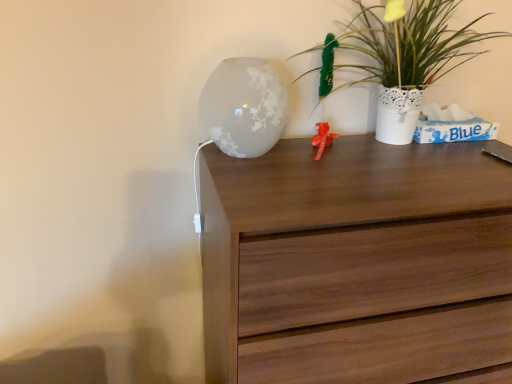
Question: Is walnut wood chest of drawers at center a part of frosted glass vase at upper center?

Choices:
 (A) no
 (B) yes

Answer: (A)

Question: From a real-world perspective, does frosted glass vase at upper center stand above walnut wood chest of drawers at center?

Choices:
 (A) no
 (B) yes

Answer: (B)

Question: Would you say frosted glass vase at upper center is outside walnut wood chest of drawers at center?

Choices:
 (A) yes
 (B) no

Answer: (A)

Question: Is frosted glass vase at upper center wider than walnut wood chest of drawers at center?

Choices:
 (A) yes
 (B) no

Answer: (B)

Question: Is frosted glass vase at upper center taller than walnut wood chest of drawers at center?

Choices:
 (A) yes
 (B) no

Answer: (B)

Question: Does frosted glass vase at upper center have a larger size compared to walnut wood chest of drawers at center?

Choices:
 (A) yes
 (B) no

Answer: (B)

Question: Is white textured vase at upper right thinner than frosted glass vase at upper center?

Choices:
 (A) no
 (B) yes

Answer: (B)

Question: Considering the relative sizes of white textured vase at upper right and frosted glass vase at upper center in the image provided, is white textured vase at upper right smaller than frosted glass vase at upper center?

Choices:
 (A) no
 (B) yes

Answer: (A)

Question: Considering the relative sizes of white textured vase at upper right and frosted glass vase at upper center in the image provided, is white textured vase at upper right bigger than frosted glass vase at upper center?

Choices:
 (A) yes
 (B) no

Answer: (A)

Question: From the image's perspective, would you say white textured vase at upper right is shown under frosted glass vase at upper center?

Choices:
 (A) no
 (B) yes

Answer: (A)

Question: From a real-world perspective, is white textured vase at upper right physically below frosted glass vase at upper center?

Choices:
 (A) yes
 (B) no

Answer: (B)

Question: Is frosted glass vase at upper center located within white textured vase at upper right?

Choices:
 (A) no
 (B) yes

Answer: (A)

Question: From a real-world perspective, is walnut wood chest of drawers at center positioned under white textured vase at upper right based on gravity?

Choices:
 (A) no
 (B) yes

Answer: (B)